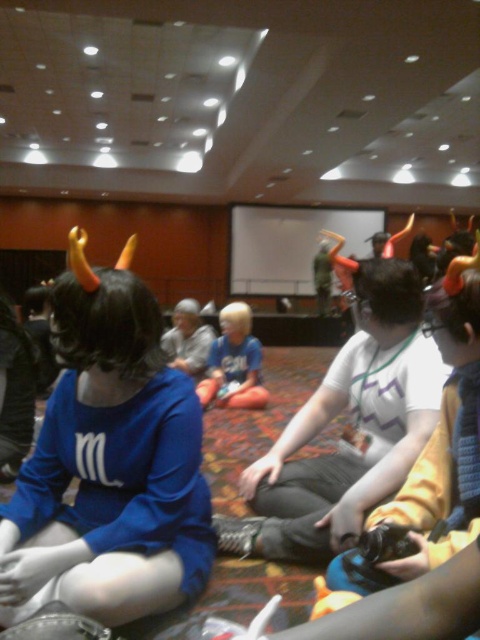
Does matte blue shirt at center have a larger size compared to light blue fabric shirt at center?

Yes.

Between matte blue shirt at center and light blue fabric shirt at center, which one has more height?

With more height is matte blue shirt at center.

Image resolution: width=480 pixels, height=640 pixels. Find the location of `matte blue shirt at center`. matte blue shirt at center is located at coordinates (108, 465).